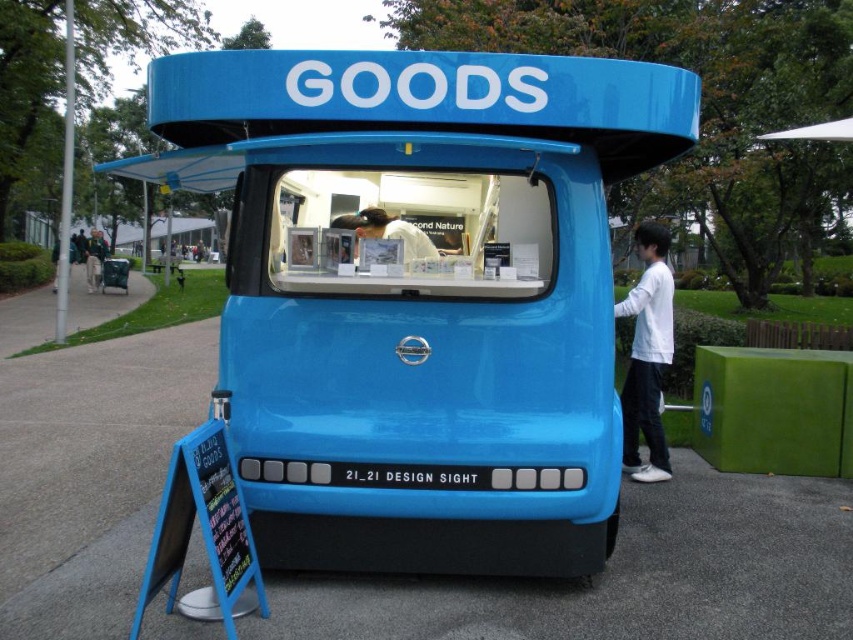
Question: Is white matte shirt at right to the left of light brown wooden bench at lower left from the viewer's perspective?

Choices:
 (A) no
 (B) yes

Answer: (A)

Question: Which object is positioned closest to the blue glossy truck at center?

Choices:
 (A) white matte shirt at right
 (B) light brown wooden bench at lower left

Answer: (A)

Question: Among these objects, which one is farthest from the camera?

Choices:
 (A) blue glossy truck at center
 (B) white matte shirt at right

Answer: (B)

Question: Which object appears closest to the camera in this image?

Choices:
 (A) white matte shirt at right
 (B) blue glossy truck at center

Answer: (B)

Question: Can you confirm if blue glossy truck at center is wider than light brown wooden bench at lower left?

Choices:
 (A) no
 (B) yes

Answer: (A)

Question: Considering the relative positions of blue glossy truck at center and light brown wooden bench at lower left in the image provided, where is blue glossy truck at center located with respect to light brown wooden bench at lower left?

Choices:
 (A) below
 (B) above

Answer: (A)